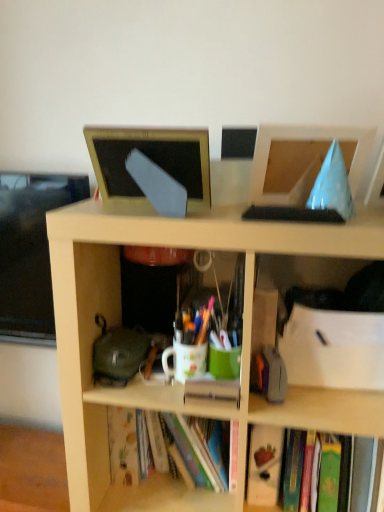
Question: Which direction should I rotate to look at matte gold frame at upper center, the 2th computer monitor viewed from the right, — up or down?

Choices:
 (A) down
 (B) up

Answer: (B)

Question: Does blue paper cone at upper right, the 2th computer monitor in the left-to-right sequence, have a larger size compared to translucent plastic pen at center?

Choices:
 (A) yes
 (B) no

Answer: (A)

Question: Is blue paper cone at upper right, marked as the 1th computer monitor in a right-to-left arrangement, positioned beyond the bounds of translucent plastic pen at center?

Choices:
 (A) no
 (B) yes

Answer: (B)

Question: From the image's perspective, is blue paper cone at upper right, the 2th computer monitor in the left-to-right sequence, on translucent plastic pen at center?

Choices:
 (A) yes
 (B) no

Answer: (A)

Question: Can you confirm if blue paper cone at upper right, the 2th computer monitor in the left-to-right sequence, is wider than translucent plastic pen at center?

Choices:
 (A) no
 (B) yes

Answer: (B)

Question: Is blue paper cone at upper right, marked as the 1th computer monitor in a right-to-left arrangement, facing towards translucent plastic pen at center?

Choices:
 (A) yes
 (B) no

Answer: (B)

Question: Are blue paper cone at upper right, the 2th computer monitor in the left-to-right sequence, and translucent plastic pen at center located far from each other?

Choices:
 (A) yes
 (B) no

Answer: (B)

Question: Is translucent plastic pen at center oriented towards matte gold frame at upper center, the 2th computer monitor viewed from the right?

Choices:
 (A) no
 (B) yes

Answer: (A)

Question: Is the depth of translucent plastic pen at center greater than that of matte gold frame at upper center, the 2th computer monitor viewed from the right?

Choices:
 (A) yes
 (B) no

Answer: (A)

Question: Is translucent plastic pen at center in contact with matte gold frame at upper center, the 2th computer monitor viewed from the right?

Choices:
 (A) yes
 (B) no

Answer: (B)

Question: Considering the relative positions of translucent plastic pen at center and matte gold frame at upper center, the 2th computer monitor viewed from the right, in the image provided, is translucent plastic pen at center in front of matte gold frame at upper center, the 2th computer monitor viewed from the right,?

Choices:
 (A) yes
 (B) no

Answer: (B)

Question: Can we say translucent plastic pen at center lies outside matte gold frame at upper center, arranged as the 1th computer monitor when viewed from the left?

Choices:
 (A) yes
 (B) no

Answer: (A)

Question: Can you confirm if translucent plastic pen at center is thinner than matte gold frame at upper center, arranged as the 1th computer monitor when viewed from the left?

Choices:
 (A) yes
 (B) no

Answer: (A)

Question: Is hardcover book at lower right bigger than matte gold frame at upper center, arranged as the 1th computer monitor when viewed from the left?

Choices:
 (A) yes
 (B) no

Answer: (A)